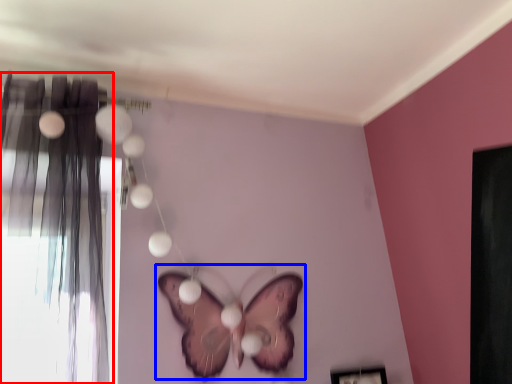
Question: Which point is further to the camera, curtain (highlighted by a red box) or butterfly (highlighted by a blue box)?

Choices:
 (A) curtain
 (B) butterfly

Answer: (B)